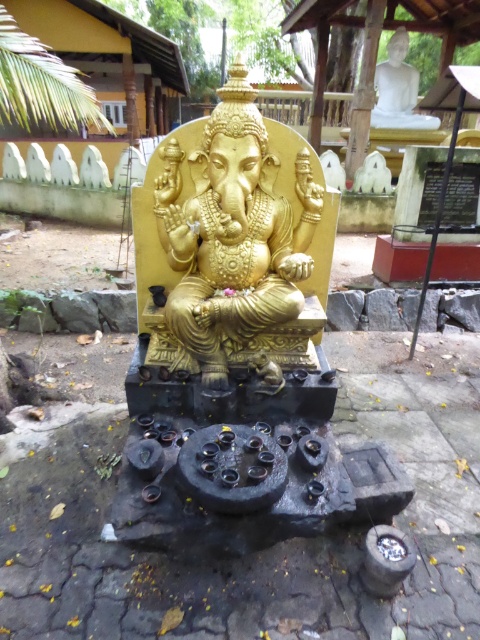
Measure the distance between point [167,296] and camera.

Point [167,296] is 11.35 feet away from camera.

Does point (180, 164) come closer to viewer compared to point (403, 54)?

Yes, point (180, 164) is in front of point (403, 54).

Is point (219, 202) farther from camera compared to point (386, 45)?

No.

Identify the location of gold polished statue at center. (231, 241).